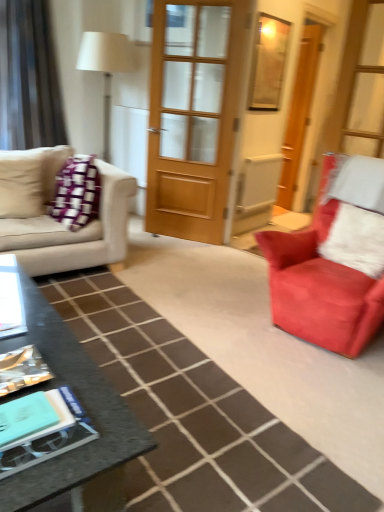
Locate an element on the screen. This screenshot has width=384, height=512. vacant region above granite black coffee table at lower left (from a real-world perspective) is located at coordinates (37, 339).